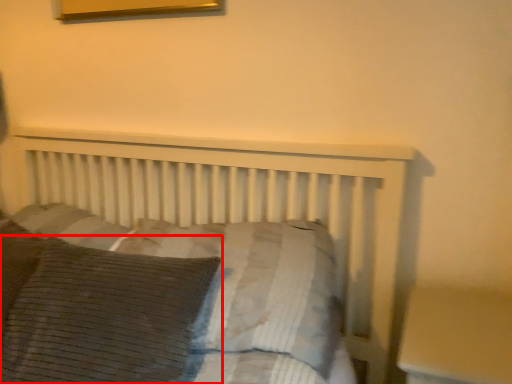
Question: From the image's perspective, considering the relative positions of pillow (annotated by the red box) and pillow in the image provided, where is pillow (annotated by the red box) located with respect to the staircase?

Choices:
 (A) below
 (B) above

Answer: (A)